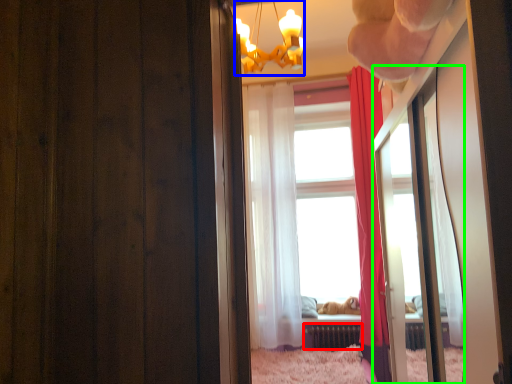
Question: Which object is positioned farthest from radiator (highlighted by a red box)? Select from lamp (highlighted by a blue box) and mirror (highlighted by a green box).

Choices:
 (A) lamp
 (B) mirror

Answer: (A)